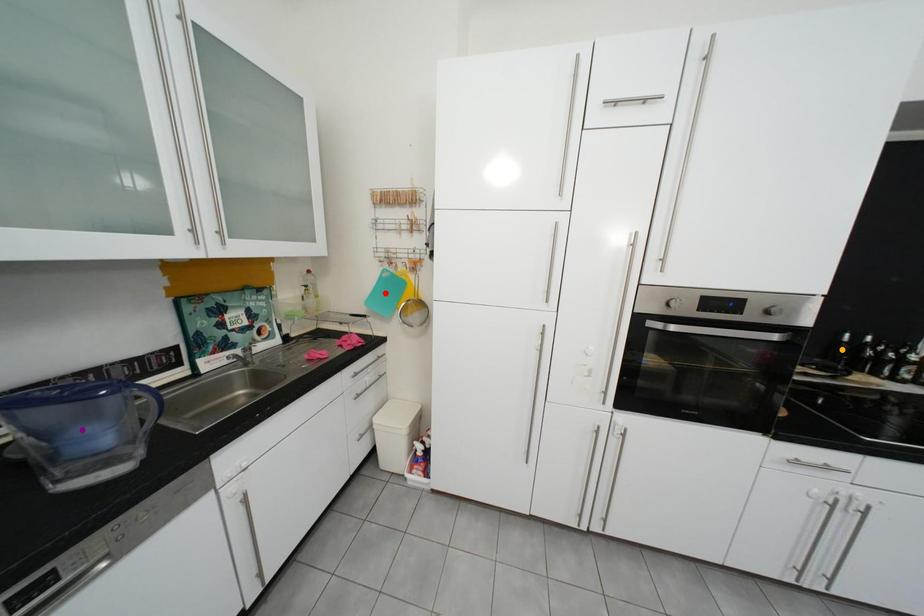
Order these from nearest to farthest:
red point, purple point, orange point

purple point < orange point < red point